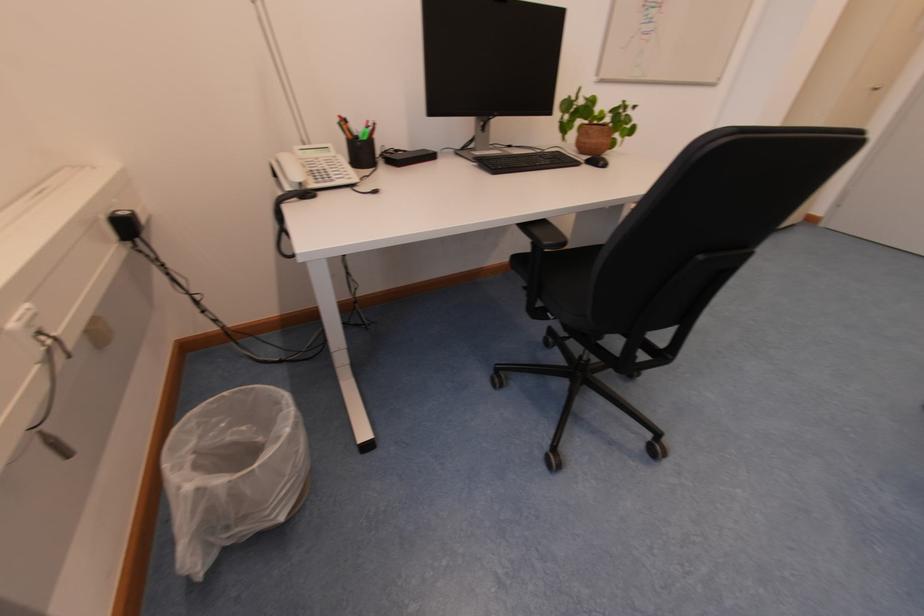
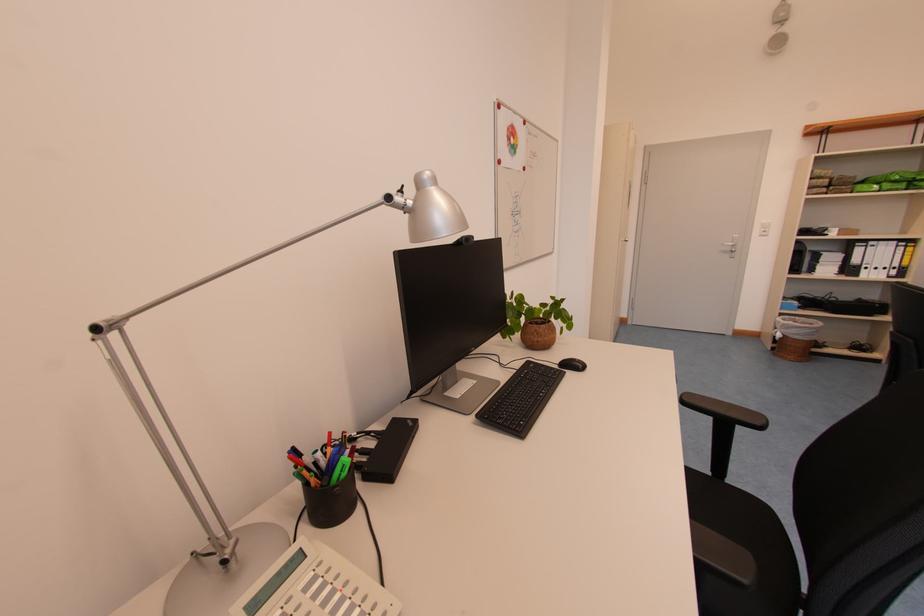
Where in the second image is the point corresponding to the point at 594,143 from the first image?

(546, 342)